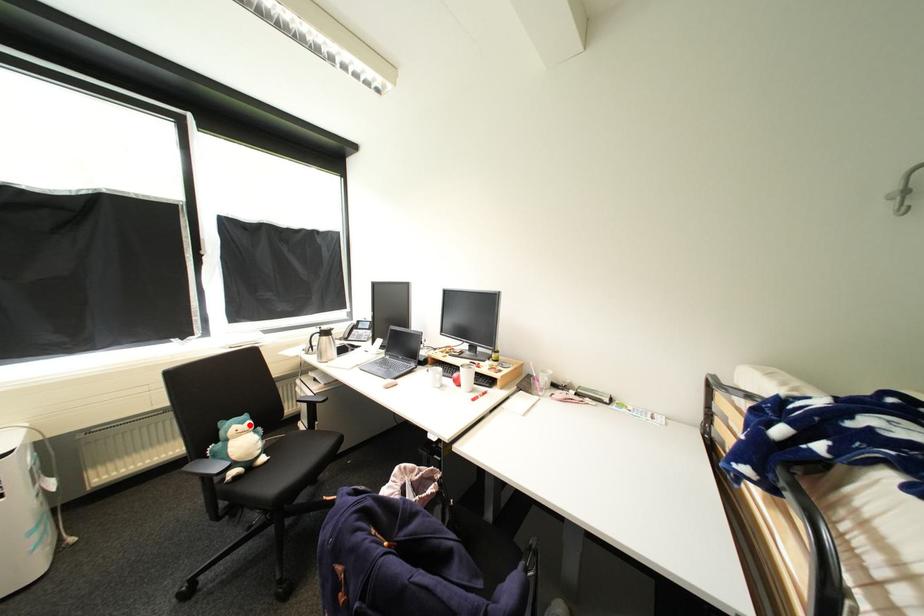
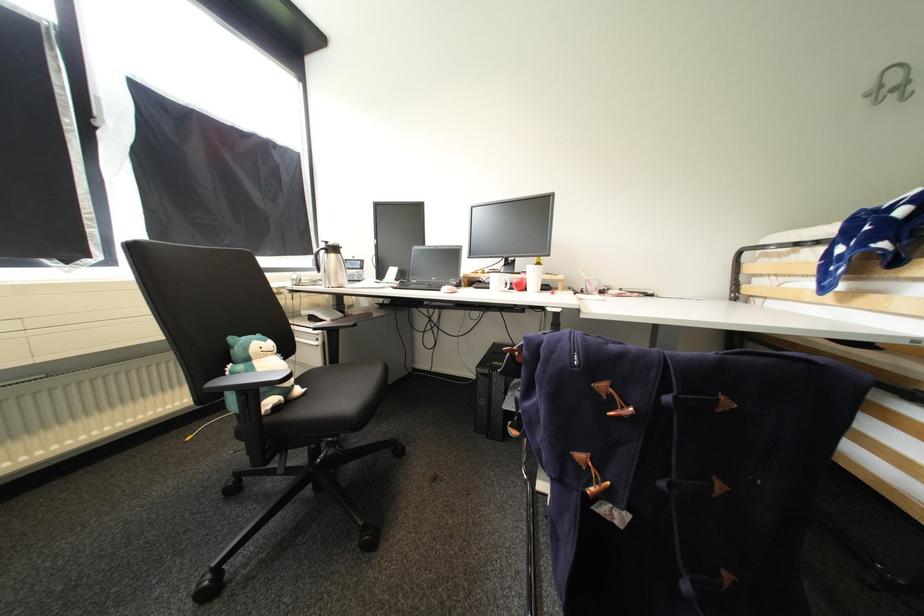
Where in the second image is the point corresponding to the highlighted location from the first image?

(272, 342)